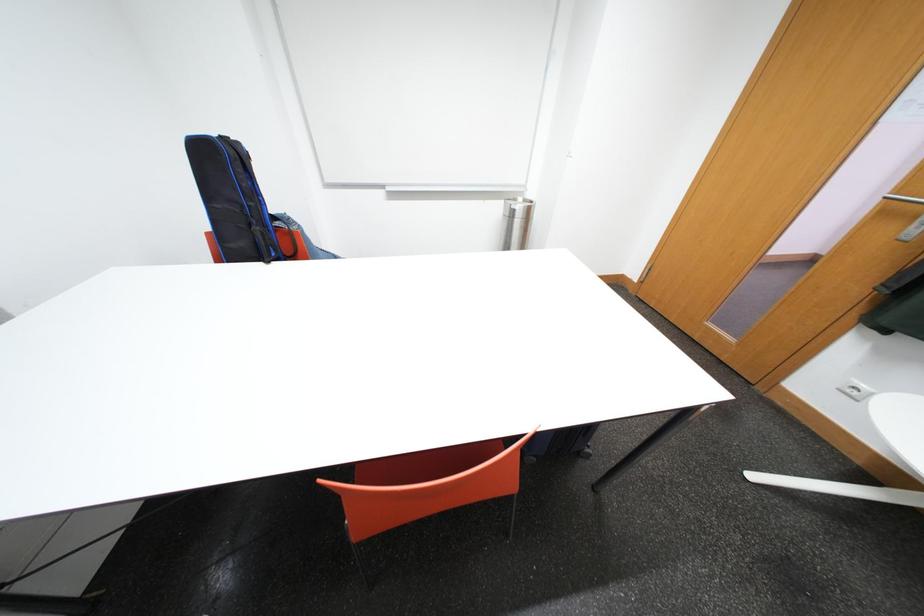
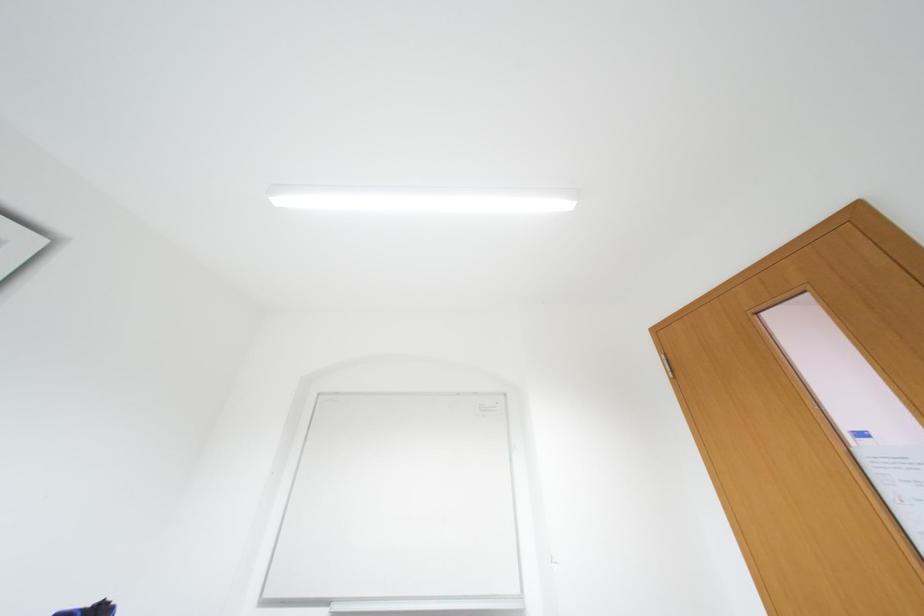
Based on the continuous images, in which direction is the camera rotating?

The rotation direction of the camera is left-up.